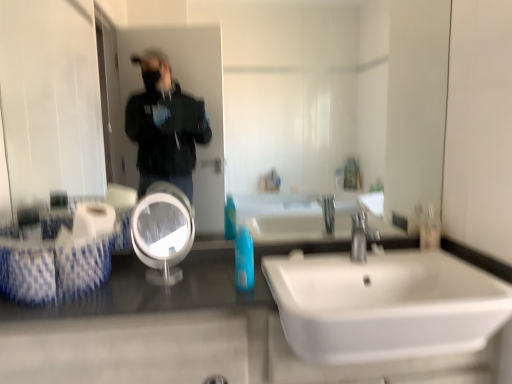
Question: Is the depth of clear glass mirror at center greater than that of clear plastic bottle at right, which is the first mouthwash in right-to-left order?

Choices:
 (A) yes
 (B) no

Answer: (B)

Question: Is the depth of clear glass mirror at center less than that of clear plastic bottle at right, which is counted as the 2th mouthwash, starting from the front?

Choices:
 (A) yes
 (B) no

Answer: (A)

Question: Considering the relative positions of clear glass mirror at center and clear plastic bottle at right, which is counted as the 2th mouthwash, starting from the front, in the image provided, is clear glass mirror at center to the right of clear plastic bottle at right, which is counted as the 2th mouthwash, starting from the front, from the viewer's perspective?

Choices:
 (A) yes
 (B) no

Answer: (B)

Question: Considering the relative sizes of clear glass mirror at center and clear plastic bottle at right, which is counted as the first mouthwash, starting from the back, in the image provided, is clear glass mirror at center smaller than clear plastic bottle at right, which is counted as the first mouthwash, starting from the back,?

Choices:
 (A) no
 (B) yes

Answer: (A)

Question: Can you confirm if clear glass mirror at center is bigger than clear plastic bottle at right, which is counted as the second mouthwash, starting from the left?

Choices:
 (A) yes
 (B) no

Answer: (A)

Question: Looking at their shapes, would you say shiny granite counter at lower left is wider or thinner than white glossy mirror at center?

Choices:
 (A) thin
 (B) wide

Answer: (B)

Question: In terms of height, does shiny granite counter at lower left look taller or shorter compared to white glossy mirror at center?

Choices:
 (A) short
 (B) tall

Answer: (B)

Question: Would you say shiny granite counter at lower left is inside or outside white glossy mirror at center?

Choices:
 (A) outside
 (B) inside

Answer: (A)

Question: Considering the positions of point (29, 314) and point (182, 201), is point (29, 314) closer or farther from the camera than point (182, 201)?

Choices:
 (A) closer
 (B) farther

Answer: (A)

Question: From the image's perspective, is satin nickel faucet at center positioned above or below clear glass mirror at center?

Choices:
 (A) below
 (B) above

Answer: (A)

Question: From a real-world perspective, relative to clear glass mirror at center, is satin nickel faucet at center vertically above or below?

Choices:
 (A) below
 (B) above

Answer: (A)

Question: From their relative heights in the image, would you say satin nickel faucet at center is taller or shorter than clear glass mirror at center?

Choices:
 (A) tall
 (B) short

Answer: (B)

Question: Is point (364, 238) closer or farther from the camera than point (421, 56)?

Choices:
 (A) closer
 (B) farther

Answer: (A)

Question: Is blue glossy mouthwash at center, the second mouthwash in the back-to-front sequence, wider or thinner than clear glass mirror at center?

Choices:
 (A) wide
 (B) thin

Answer: (A)

Question: From the image's perspective, is blue glossy mouthwash at center, marked as the second mouthwash in a right-to-left arrangement, located above or below clear glass mirror at center?

Choices:
 (A) above
 (B) below

Answer: (B)